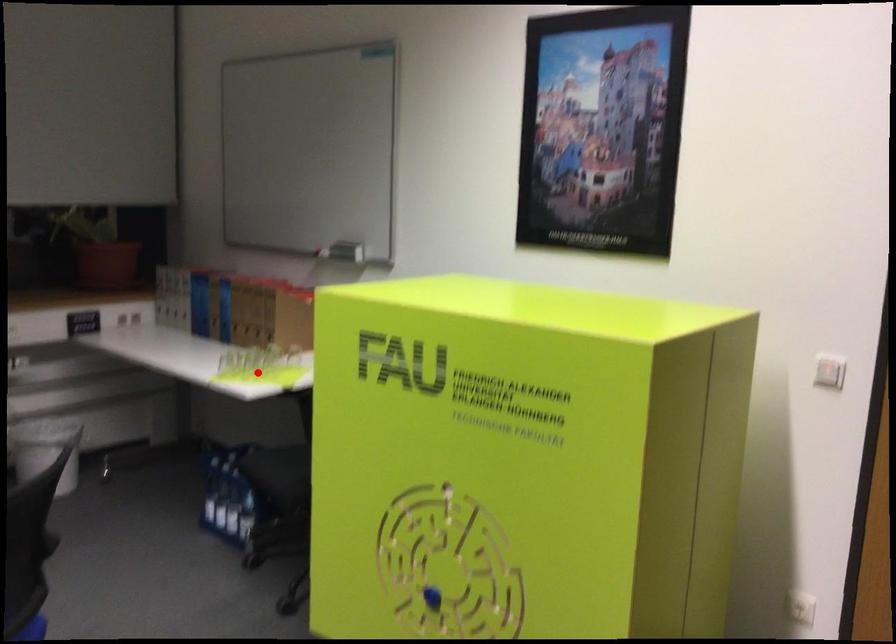
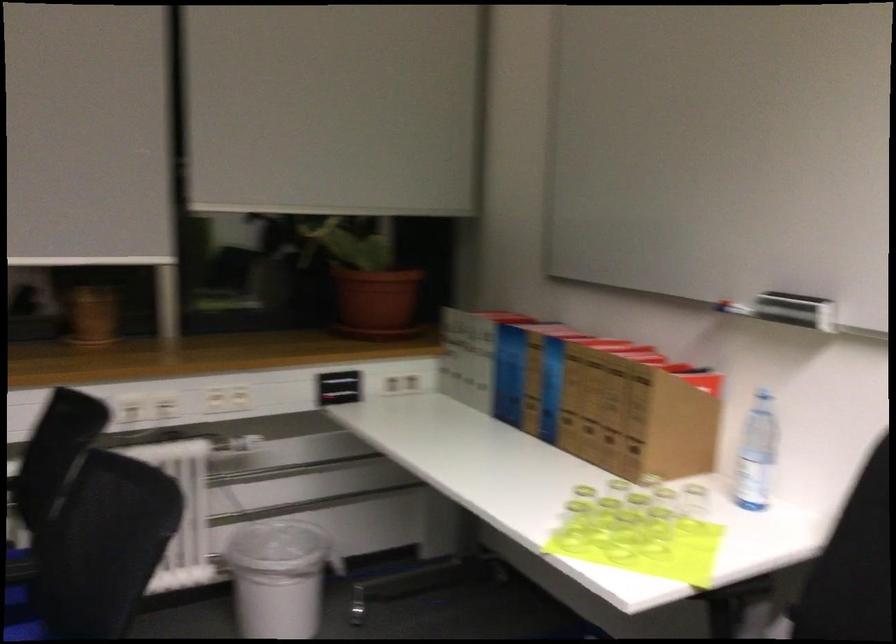
Where in the second image is the point corresponding to the highlighted location from the first image?

(623, 536)